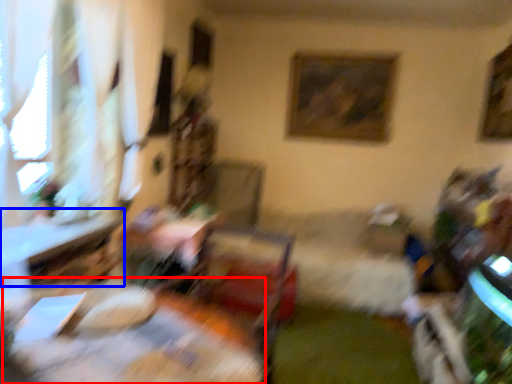
Question: Which of the following is the closest to the observer, table (highlighted by a red box) or table (highlighted by a blue box)?

Choices:
 (A) table
 (B) table

Answer: (A)